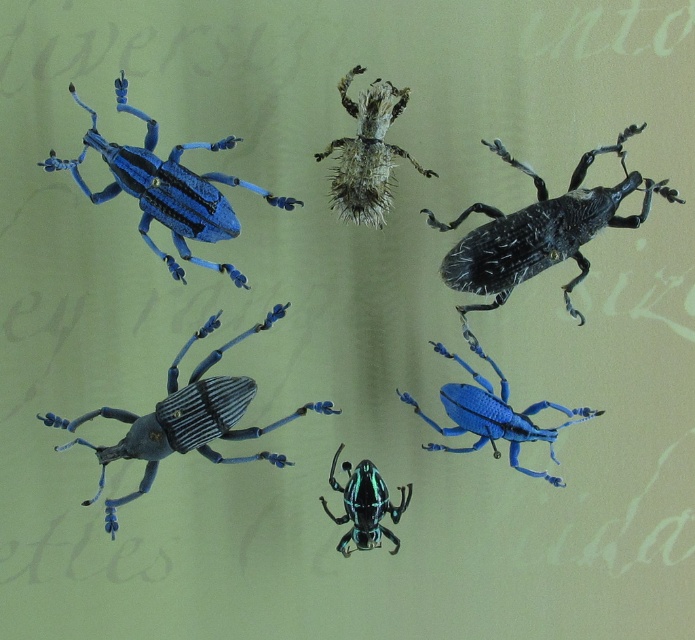
In the image, there are two beetles, the matte blue beetle at lower right and the metallic green beetle at center. Which one is positioned higher up in the image?

The matte blue beetle at lower right is positioned above the metallic green beetle at center, so it is higher up in the image.

You are a collector trying to place the shiny black beetle at upper right and the metallic green beetle at center into a display case. The case has two slots side by side. If you want to arrange them without overlapping, which beetle should be placed first to ensure they both fit?

The shiny black beetle at upper right should be placed first since it might be wider than the metallic green beetle at center, ensuring there is enough space for both in the display case.